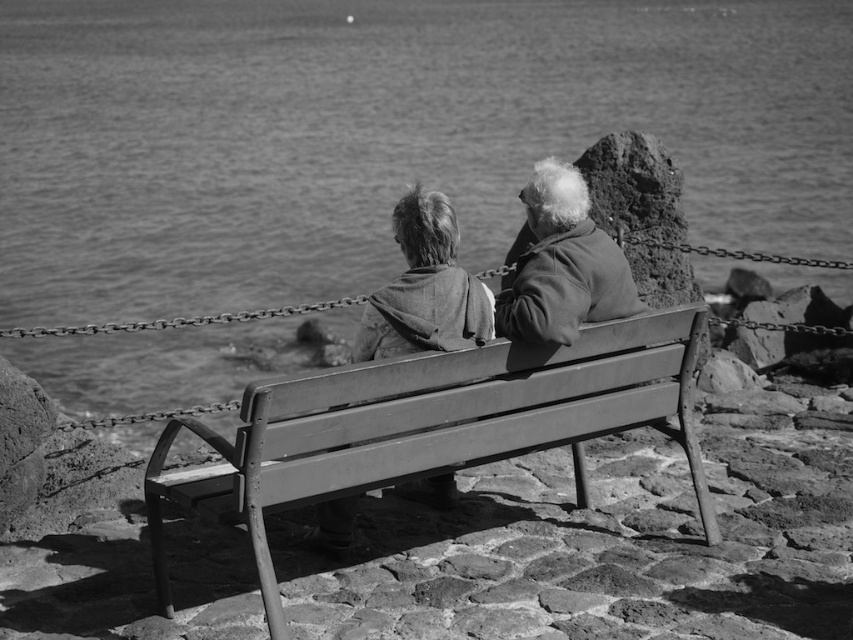
Question: Among these points, which one is farthest from the camera?

Choices:
 (A) (442, 268)
 (B) (207, 346)
 (C) (520, 260)
 (D) (155, 461)

Answer: (B)

Question: Considering the real-world distances, which object is closest to the metal bench at center?

Choices:
 (A) coarse woolen sweater at center
 (B) coarse fabric jacket at center
 (C) smooth water at bench center

Answer: (B)

Question: Is smooth water at bench center smaller than coarse woolen sweater at center?

Choices:
 (A) no
 (B) yes

Answer: (A)

Question: Among these objects, which one is nearest to the camera?

Choices:
 (A) metal bench at center
 (B) coarse woolen sweater at center

Answer: (A)

Question: Is smooth water at bench center smaller than metal bench at center?

Choices:
 (A) yes
 (B) no

Answer: (B)

Question: Where is smooth water at bench center located in relation to coarse woolen sweater at center in the image?

Choices:
 (A) below
 (B) above

Answer: (B)